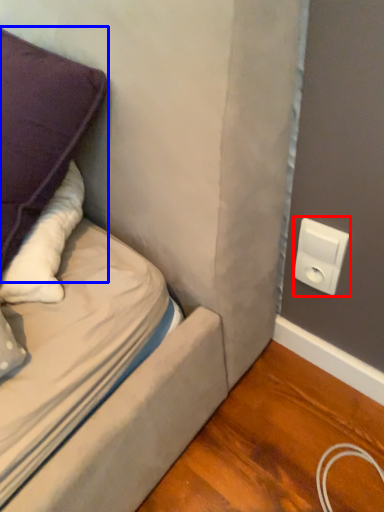
Question: Which of the following is the closest to the observer, electric outlet (highlighted by a red box) or pillow (highlighted by a blue box)?

Choices:
 (A) electric outlet
 (B) pillow

Answer: (B)